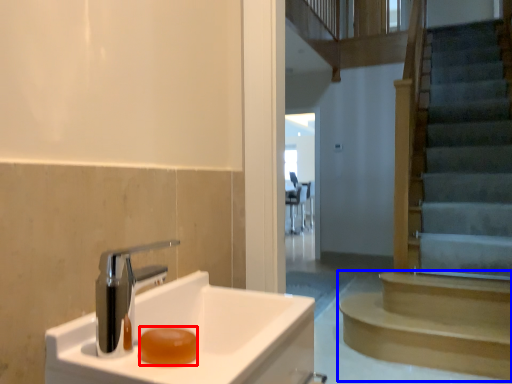
Question: Which point is further to the camera, soap (highlighted by a red box) or stairs (highlighted by a blue box)?

Choices:
 (A) soap
 (B) stairs

Answer: (B)